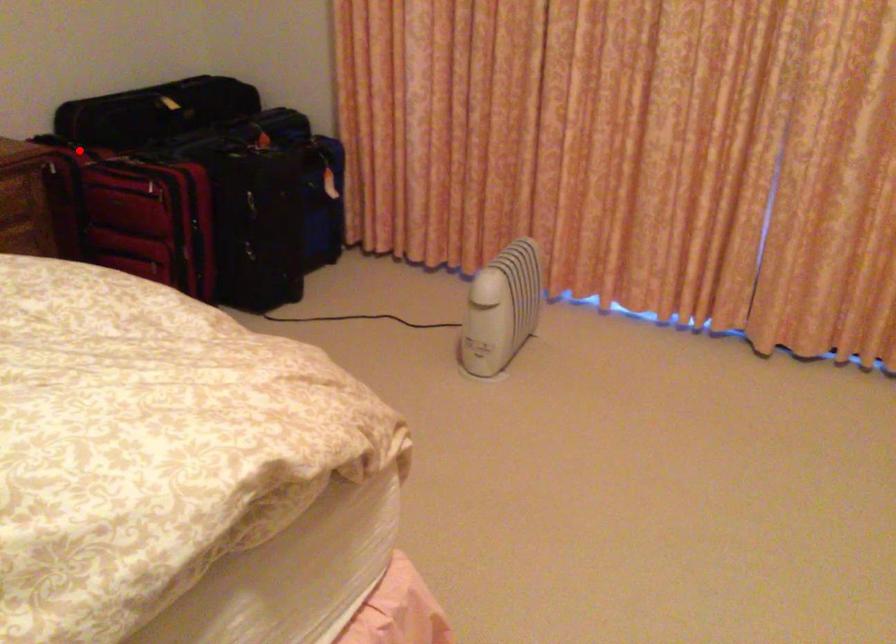
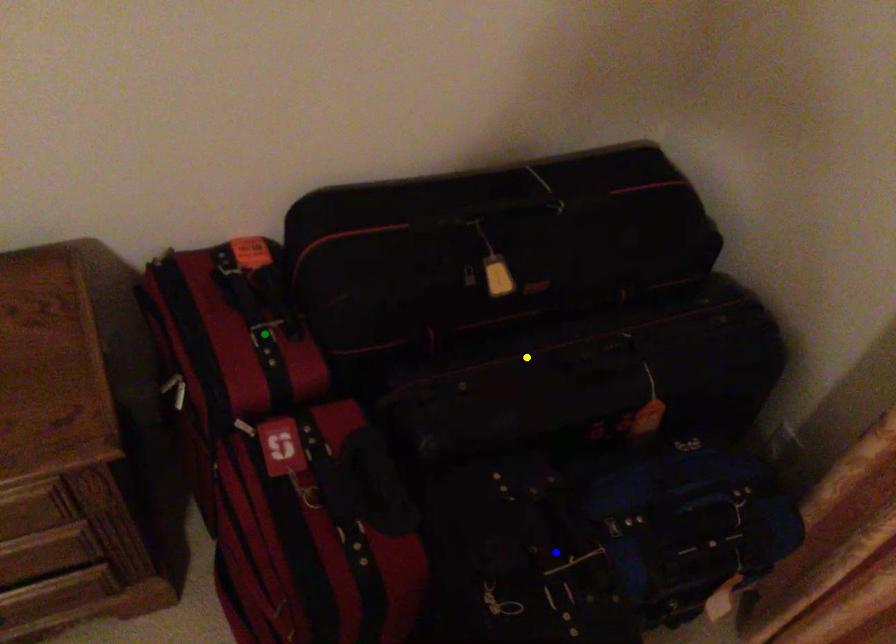
Question: I am providing you with two images of the same scene from different viewpoints. A red point is marked on the first image. You are given multiple points on the second image. Which mark in image 2 goes with the point in image 1?

Choices:
 (A) green point
 (B) yellow point
 (C) blue point

Answer: (A)